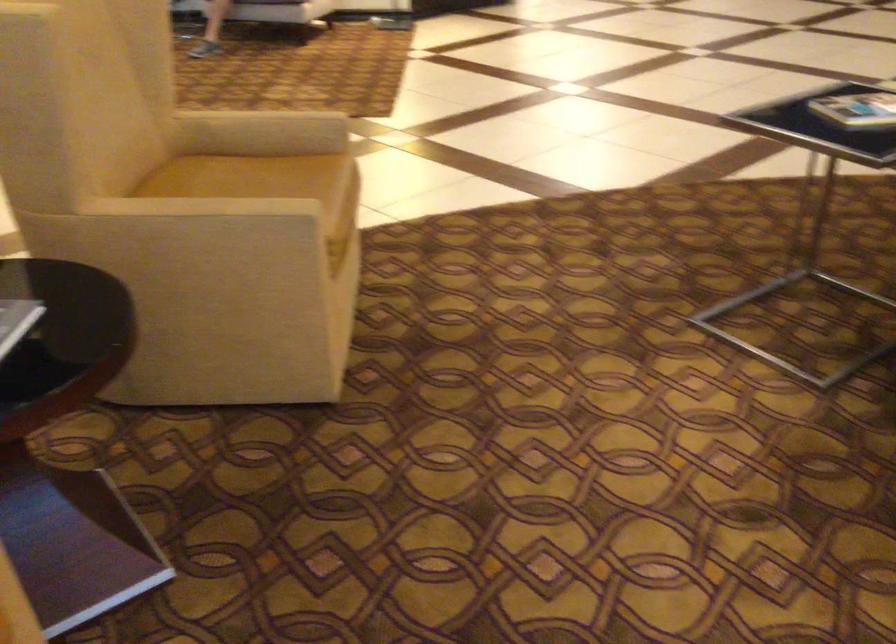
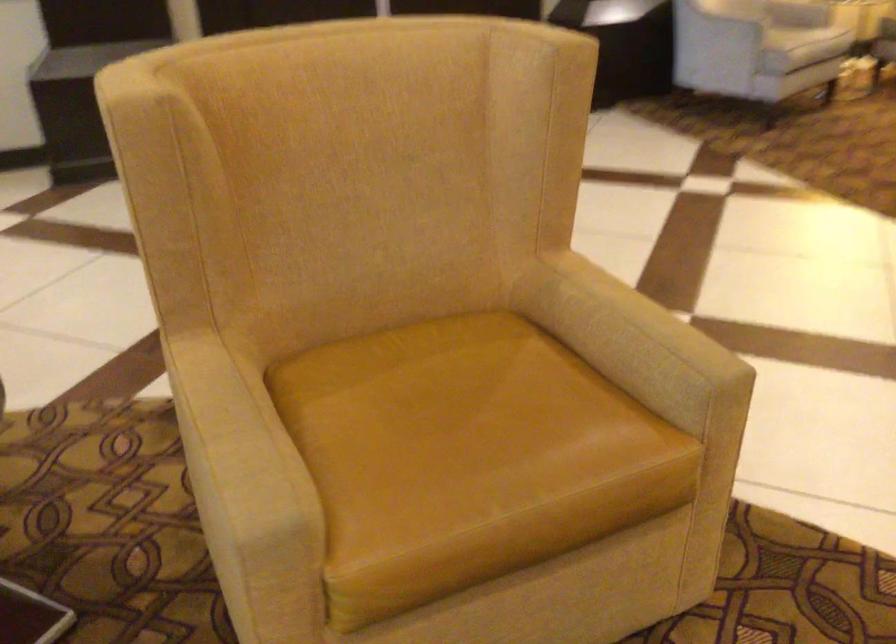
In the second image, find the point that corresponds to point (279, 122) in the first image.

(624, 322)